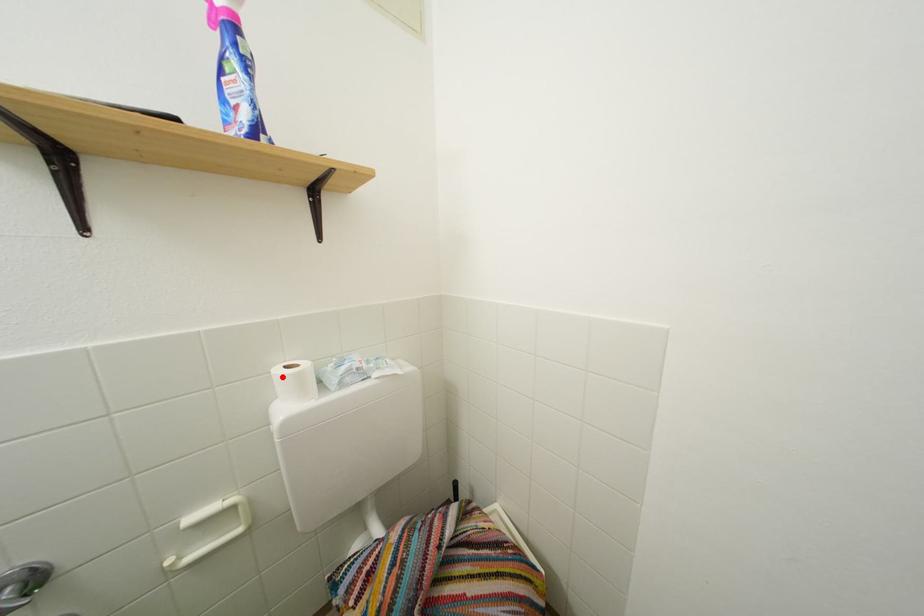
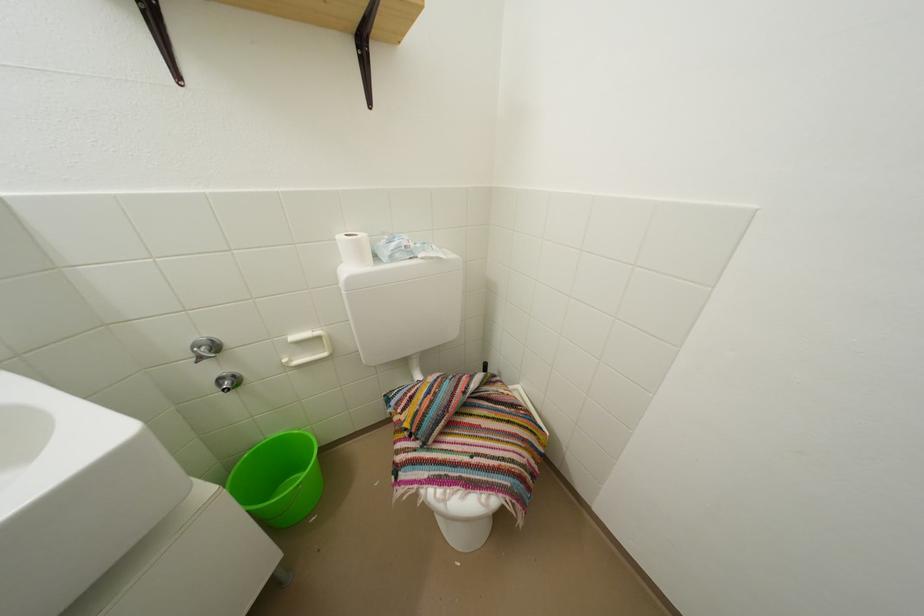
In the second image, find the point that corresponds to the highlighted location in the first image.

(346, 243)